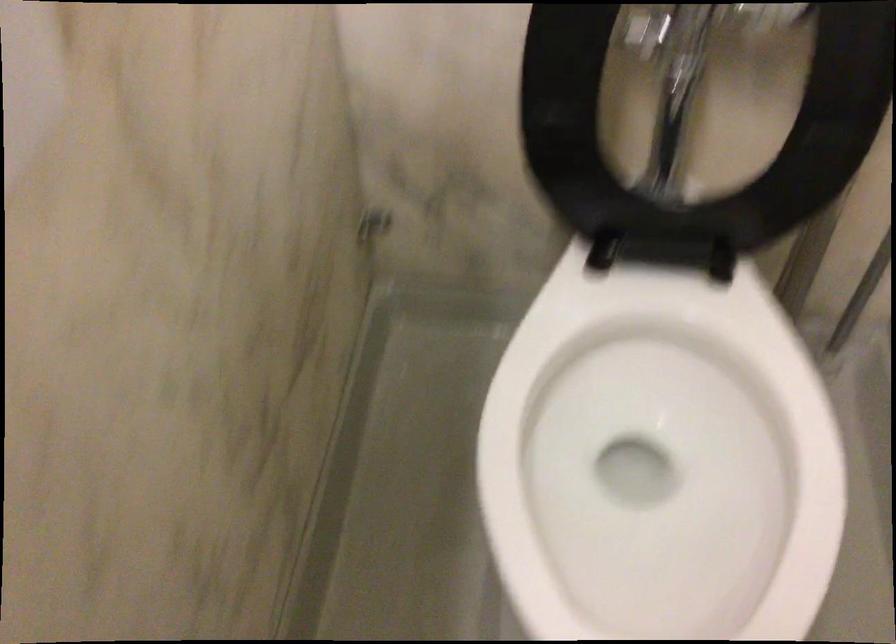
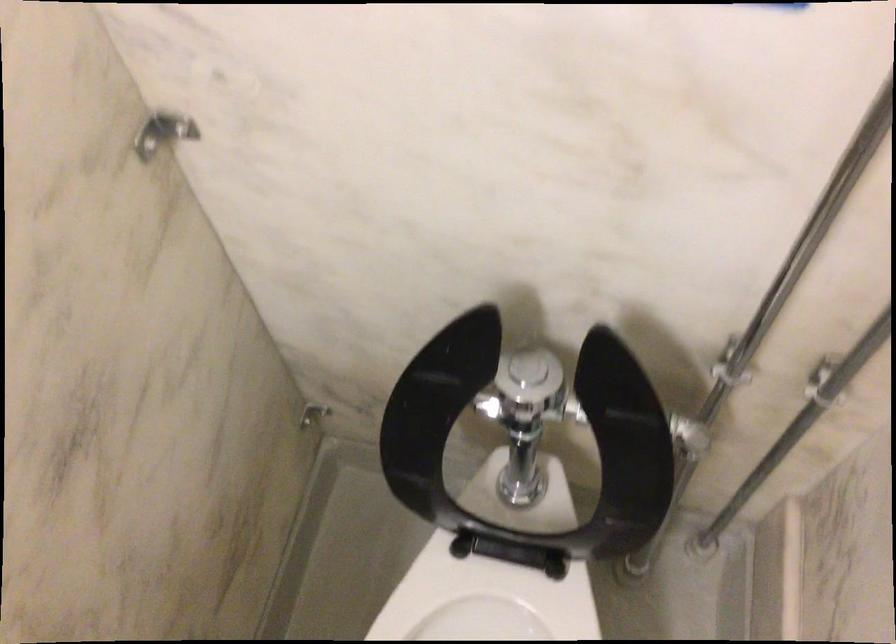
Question: How did the camera likely rotate?

Choices:
 (A) Left
 (B) Right
 (C) Up
 (D) Down

Answer: (D)